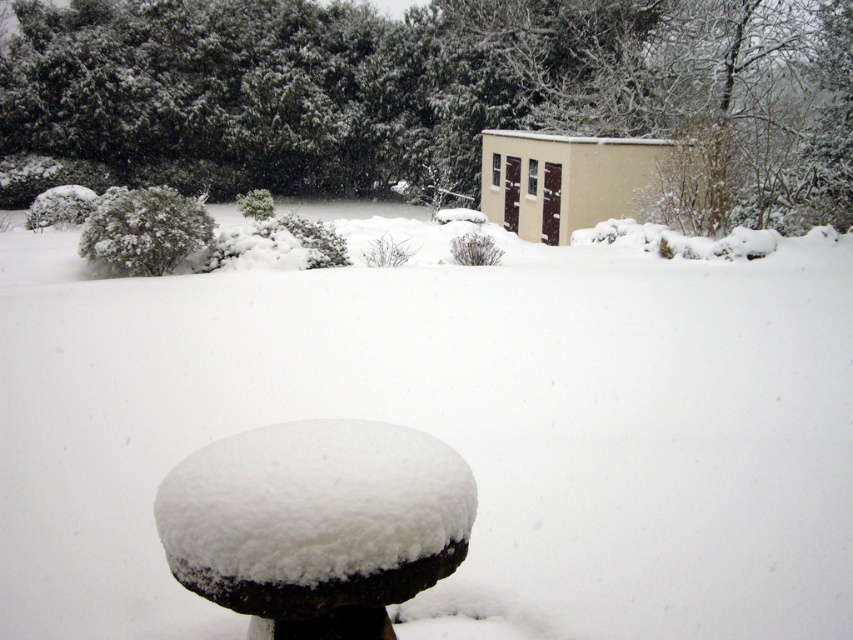
Question: Which of the following is the farthest from the observer?

Choices:
 (A) white fluffy snow at center
 (B) white snow-covered stool at center
 (C) beige matte shed at upper center

Answer: (C)

Question: From the image, what is the correct spatial relationship of white fluffy snow at center in relation to green leafy tree at upper center?

Choices:
 (A) above
 (B) below

Answer: (B)

Question: Is green leafy tree at upper center above white snow-covered stool at center?

Choices:
 (A) yes
 (B) no

Answer: (A)

Question: Can you confirm if white fluffy snow at center is positioned to the right of white snow-covered stool at center?

Choices:
 (A) no
 (B) yes

Answer: (A)

Question: Which point appears closest to the camera in this image?

Choices:
 (A) (410, 154)
 (B) (814, 248)
 (C) (517, 161)
 (D) (293, 490)

Answer: (D)

Question: Which point is farther to the camera?

Choices:
 (A) white fluffy snow at center
 (B) beige matte shed at upper center
 (C) white snow-covered stool at center
 (D) green leafy tree at upper center

Answer: (B)